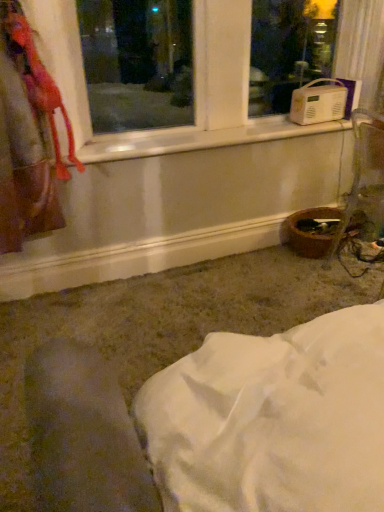
Question: From their relative heights in the image, would you say velvet-like pink scarf at upper left is taller or shorter than white plastic radio at upper right?

Choices:
 (A) short
 (B) tall

Answer: (B)

Question: Considering their positions, is velvet-like pink scarf at upper left located in front of or behind white plastic radio at upper right?

Choices:
 (A) front
 (B) behind

Answer: (A)

Question: In terms of width, does velvet-like pink scarf at upper left look wider or thinner when compared to white plastic radio at upper right?

Choices:
 (A) wide
 (B) thin

Answer: (B)

Question: From the image's perspective, is white plastic radio at upper right located above or below velvet-like pink scarf at upper left?

Choices:
 (A) below
 (B) above

Answer: (B)

Question: Considering the positions of white plastic radio at upper right and velvet-like pink scarf at upper left in the image, is white plastic radio at upper right wider or thinner than velvet-like pink scarf at upper left?

Choices:
 (A) wide
 (B) thin

Answer: (A)

Question: Is white plastic radio at upper right spatially inside velvet-like pink scarf at upper left, or outside of it?

Choices:
 (A) inside
 (B) outside

Answer: (B)

Question: Is white plastic radio at upper right in front of or behind velvet-like pink scarf at upper left in the image?

Choices:
 (A) front
 (B) behind

Answer: (B)